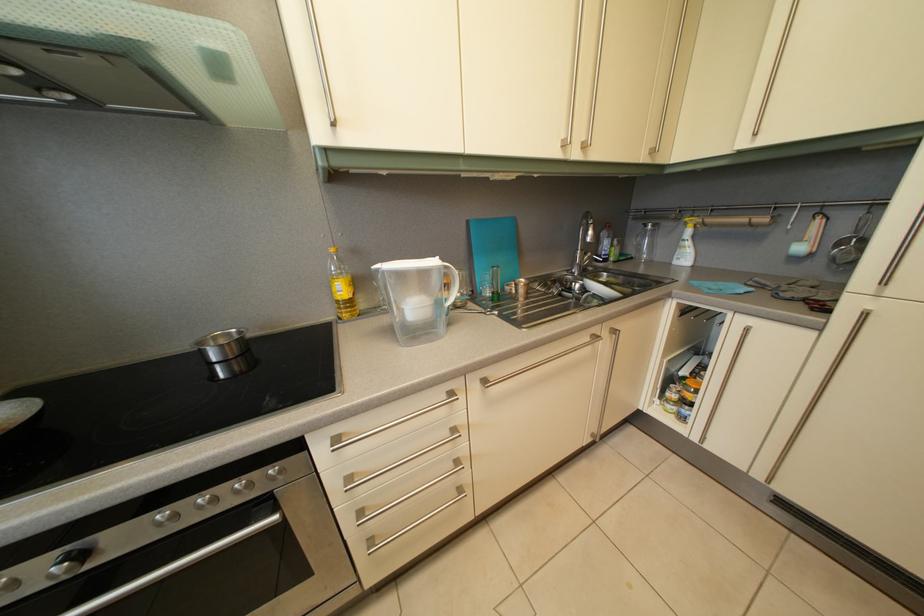
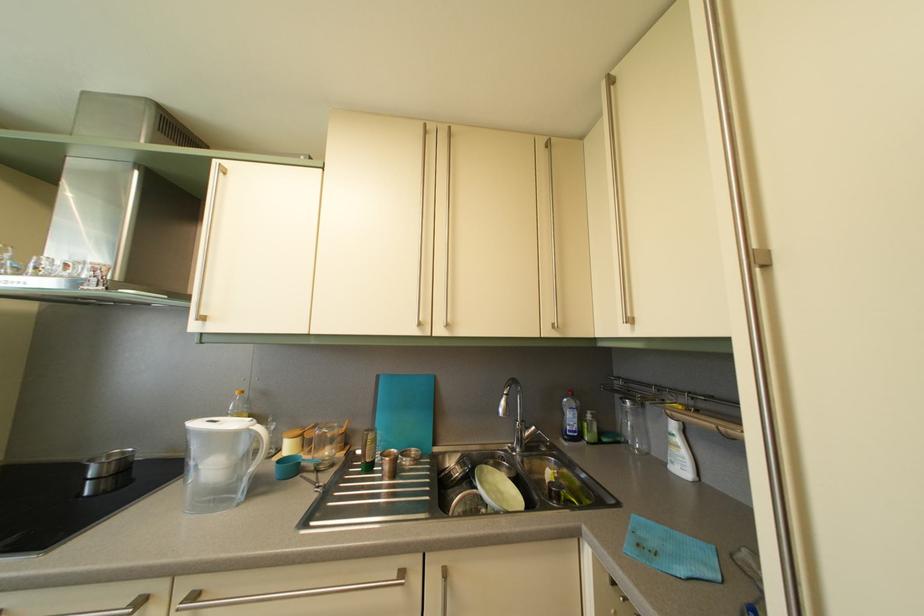
The point at (697, 251) is marked in the first image. Where is the corresponding point in the second image?

(687, 448)